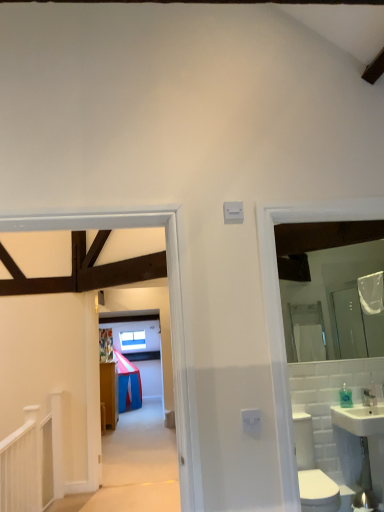
Question: Would you say clear plastic bottle at right is outside wooden floorboards at center?

Choices:
 (A) yes
 (B) no

Answer: (A)

Question: From the image's perspective, would you say clear plastic bottle at right is positioned over wooden floorboards at center?

Choices:
 (A) yes
 (B) no

Answer: (B)

Question: Does clear plastic bottle at right have a larger size compared to wooden floorboards at center?

Choices:
 (A) no
 (B) yes

Answer: (A)

Question: Considering the relative sizes of clear plastic bottle at right and wooden floorboards at center in the image provided, is clear plastic bottle at right taller than wooden floorboards at center?

Choices:
 (A) no
 (B) yes

Answer: (A)

Question: Considering the relative positions of clear plastic bottle at right and wooden floorboards at center in the image provided, is clear plastic bottle at right to the left of wooden floorboards at center from the viewer's perspective?

Choices:
 (A) yes
 (B) no

Answer: (B)

Question: From the image's perspective, is white ceramic sink at right above or below white glossy toilet bowl at lower right?

Choices:
 (A) below
 (B) above

Answer: (B)

Question: Which is correct: white ceramic sink at right is inside white glossy toilet bowl at lower right, or outside of it?

Choices:
 (A) outside
 (B) inside

Answer: (A)

Question: Is white ceramic sink at right wider or thinner than white glossy toilet bowl at lower right?

Choices:
 (A) thin
 (B) wide

Answer: (A)

Question: From a real-world perspective, relative to white glossy toilet bowl at lower right, is white ceramic sink at right vertically above or below?

Choices:
 (A) below
 (B) above

Answer: (B)

Question: From a real-world perspective, is transparent glass window at upper center above or below clear glass mirror at right?

Choices:
 (A) above
 (B) below

Answer: (B)

Question: In terms of size, does transparent glass window at upper center appear bigger or smaller than clear glass mirror at right?

Choices:
 (A) small
 (B) big

Answer: (B)

Question: Would you say transparent glass window at upper center is to the left or to the right of clear glass mirror at right in the picture?

Choices:
 (A) left
 (B) right

Answer: (A)

Question: Do you think transparent glass window at upper center is within clear glass mirror at right, or outside of it?

Choices:
 (A) inside
 (B) outside

Answer: (B)

Question: From the image's perspective, relative to clear glass mirror at right, is clear plastic bottle at right above or below?

Choices:
 (A) above
 (B) below

Answer: (B)

Question: Choose the correct answer: Is clear plastic bottle at right inside clear glass mirror at right or outside it?

Choices:
 (A) inside
 (B) outside

Answer: (B)